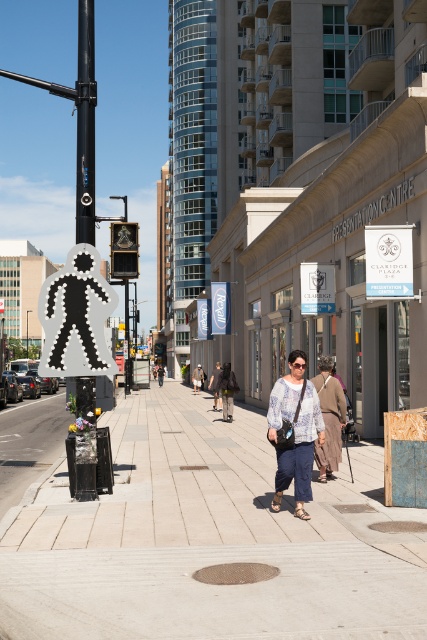
Question: Is black metal pole at upper center thinner than white lace blouse at center?

Choices:
 (A) yes
 (B) no

Answer: (B)

Question: Can you confirm if gray concrete sidewalk at center is smaller than black metal pole at upper center?

Choices:
 (A) yes
 (B) no

Answer: (A)

Question: Can you confirm if white lace blouse at center is positioned to the right of khaki cotton pants at center?

Choices:
 (A) yes
 (B) no

Answer: (A)

Question: Which point is closer to the camera?

Choices:
 (A) khaki cotton pants at center
 (B) matte blue jeans at center
 (C) black metal pole at upper center
 (D) denim pants at center

Answer: (B)

Question: Which point is farther to the camera?

Choices:
 (A) (225, 392)
 (B) (304, 464)
 (C) (192, 374)

Answer: (C)

Question: Which point is farther from the camera taking this photo?

Choices:
 (A) (81, 180)
 (B) (221, 390)
 (C) (310, 449)

Answer: (B)